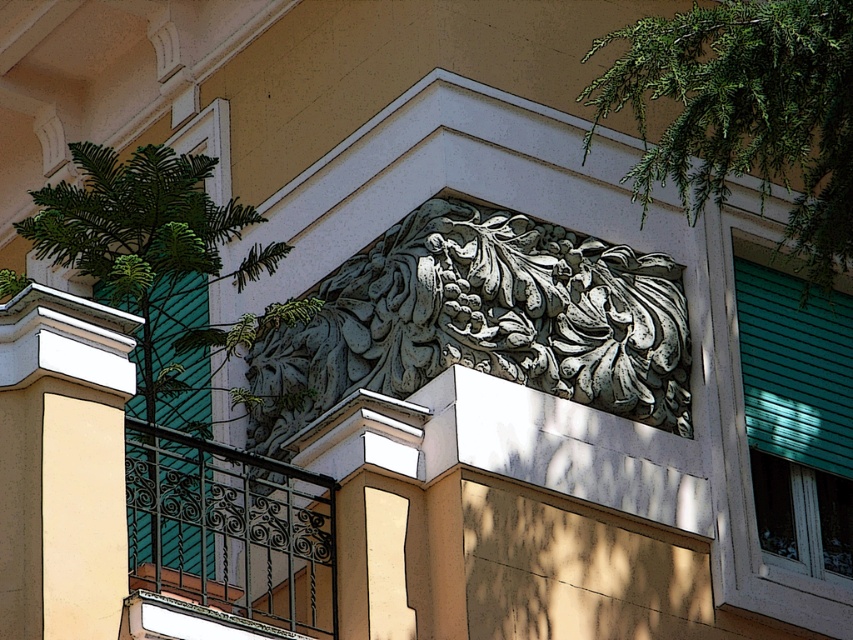
Can you confirm if green patina stone carving at center is positioned to the right of white smooth pillar at left?

Indeed, green patina stone carving at center is positioned on the right side of white smooth pillar at left.

In order to click on green patina stone carving at center in this screenshot , I will do point(482,321).

Between point (535, 336) and point (111, 340), which one is positioned behind?

The point (535, 336) is behind.

This screenshot has height=640, width=853. I want to click on green patina stone carving at center, so click(x=482, y=321).

Between green patina stone carving at center and green leafy tree at upper left, which one appears on the right side from the viewer's perspective?

From the viewer's perspective, green patina stone carving at center appears more on the right side.

The height and width of the screenshot is (640, 853). What are the coordinates of `green patina stone carving at center` in the screenshot? It's located at (482, 321).

Looking at this image, is white smooth pillar at left smaller than black wrought iron balcony at lower left?

Yes, white smooth pillar at left is smaller than black wrought iron balcony at lower left.

Who is more distant from viewer, (62, 612) or (158, 480)?

The point (158, 480) is more distant.

The width and height of the screenshot is (853, 640). In order to click on white smooth pillar at left in this screenshot , I will do `click(62, 465)`.